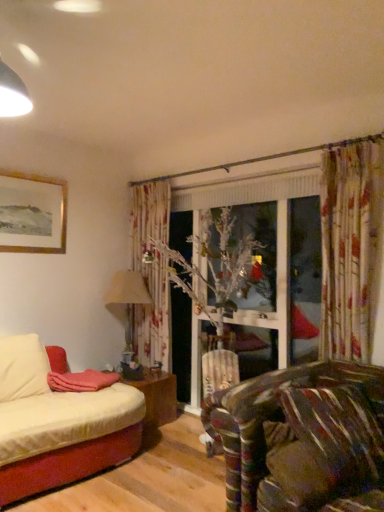
Question: Could you tell me if wooden table at lower left is turned towards gold-framed painting at upper left?

Choices:
 (A) no
 (B) yes

Answer: (A)

Question: Would you say gold-framed painting at upper left is part of wooden table at lower left's contents?

Choices:
 (A) yes
 (B) no

Answer: (B)

Question: Is wooden table at lower left behind gold-framed painting at upper left?

Choices:
 (A) no
 (B) yes

Answer: (B)

Question: Is gold-framed painting at upper left at the back of wooden table at lower left?

Choices:
 (A) no
 (B) yes

Answer: (A)

Question: Is wooden table at lower left not near gold-framed painting at upper left?

Choices:
 (A) no
 (B) yes

Answer: (B)

Question: Can you confirm if wooden table at lower left is shorter than gold-framed painting at upper left?

Choices:
 (A) no
 (B) yes

Answer: (B)

Question: Is beige fabric lampshade at center taller than velvet brown pillow at lower right, the 2th pillow positioned from the left?

Choices:
 (A) no
 (B) yes

Answer: (B)

Question: From the image's perspective, is beige fabric lampshade at center located beneath velvet brown pillow at lower right, marked as the first pillow in a right-to-left arrangement?

Choices:
 (A) yes
 (B) no

Answer: (B)

Question: From a real-world perspective, does beige fabric lampshade at center stand above velvet brown pillow at lower right, marked as the first pillow in a right-to-left arrangement?

Choices:
 (A) no
 (B) yes

Answer: (B)

Question: Considering the relative positions of beige fabric lampshade at center and velvet brown pillow at lower right, the 2th pillow positioned from the left, in the image provided, is beige fabric lampshade at center to the right of velvet brown pillow at lower right, the 2th pillow positioned from the left, from the viewer's perspective?

Choices:
 (A) no
 (B) yes

Answer: (A)

Question: Considering the relative sizes of beige fabric lampshade at center and velvet brown pillow at lower right, the 2th pillow positioned from the left, in the image provided, is beige fabric lampshade at center shorter than velvet brown pillow at lower right, the 2th pillow positioned from the left,?

Choices:
 (A) yes
 (B) no

Answer: (B)

Question: Is beige fabric lampshade at center oriented towards velvet brown pillow at lower right, the 2th pillow positioned from the left?

Choices:
 (A) no
 (B) yes

Answer: (B)

Question: Is brown textured pillow at lower right, which appears as the second pillow when viewed from the right, far away from velvet brown pillow at lower right, marked as the first pillow in a right-to-left arrangement?

Choices:
 (A) no
 (B) yes

Answer: (A)